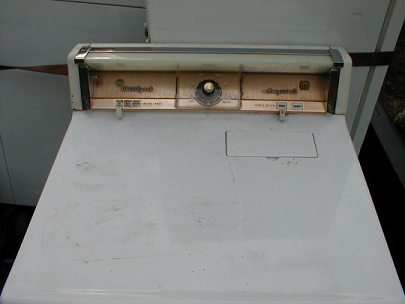
Where is `wall`? Image resolution: width=405 pixels, height=304 pixels. wall is located at coordinates (29, 127).